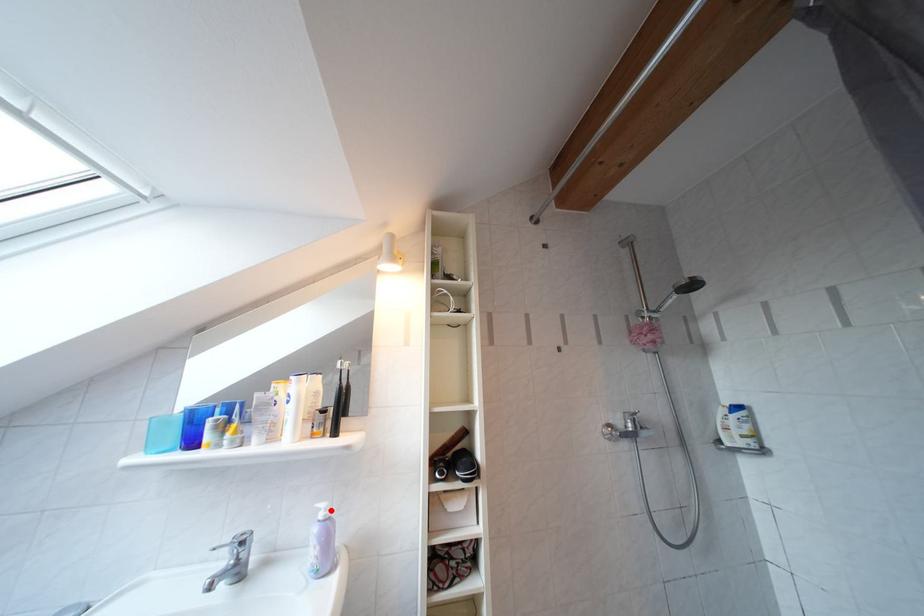
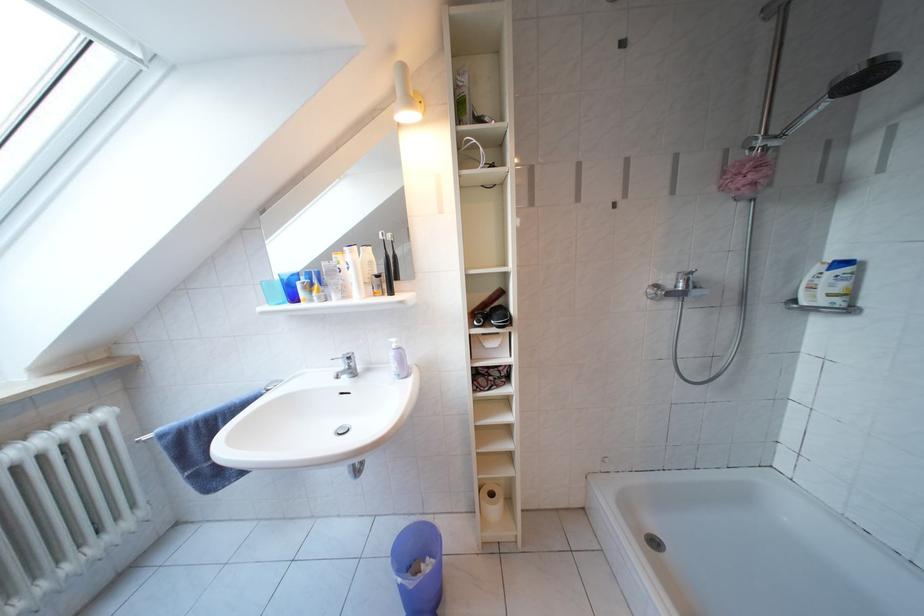
Find the pixel in the second image that matches the highlighted location in the first image.

(402, 345)